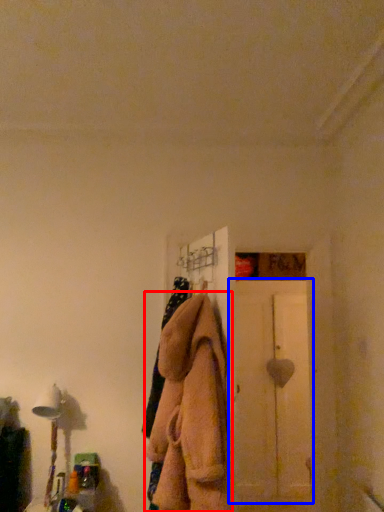
Question: Which object is closer to the camera taking this photo, clothing (highlighted by a red box) or screen door (highlighted by a blue box)?

Choices:
 (A) clothing
 (B) screen door

Answer: (A)